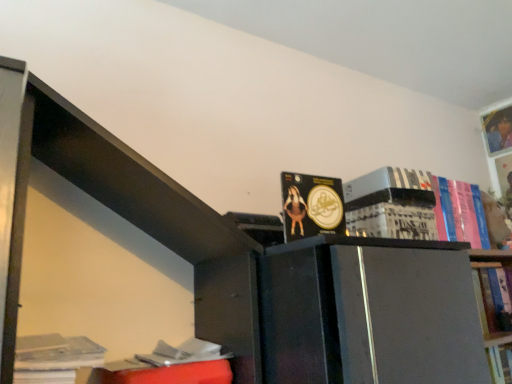
Question: Considering the positions of hardcover book at upper right, marked as the third book in a back-to-front arrangement, and white paper at center, the second paperback book positioned from the top, in the image, is hardcover book at upper right, marked as the third book in a back-to-front arrangement, bigger or smaller than white paper at center, the second paperback book positioned from the top,?

Choices:
 (A) big
 (B) small

Answer: (A)

Question: From a real-world perspective, is hardcover book at upper right, positioned as the 3th book in left-to-right order, positioned above or below white paper at center, the second paperback book positioned from the top?

Choices:
 (A) below
 (B) above

Answer: (B)

Question: Considering the real-world distances, which object is closest to the black matte book at upper right, the first paperback book in the top-to-bottom sequence?

Choices:
 (A) white paper at center, the second paperback book positioned from the top
 (B) white paper stack at lower left, the fifth book when ordered from right to left
 (C) hardcover book at upper right, marked as the second book in a right-to-left arrangement
 (D) hardcover book at upper right, the first book viewed from the right
 (E) matte gold coin at center, the 4th book when ordered from right to left

Answer: (A)

Question: Based on their relative distances, which object is nearer to the hardcover book at upper right, arranged as the 3th book when viewed from the front?

Choices:
 (A) black matte book at upper right, the 2th paperback book when ordered from bottom to top
 (B) white paper stack at lower left, which ranks as the fifth book in back-to-front order
 (C) hardcover book at upper right, the 1th book viewed from the back
 (D) hardcover book at upper right, arranged as the 4th book when viewed from the left
 (E) white paper at center, the second paperback book positioned from the top

Answer: (A)